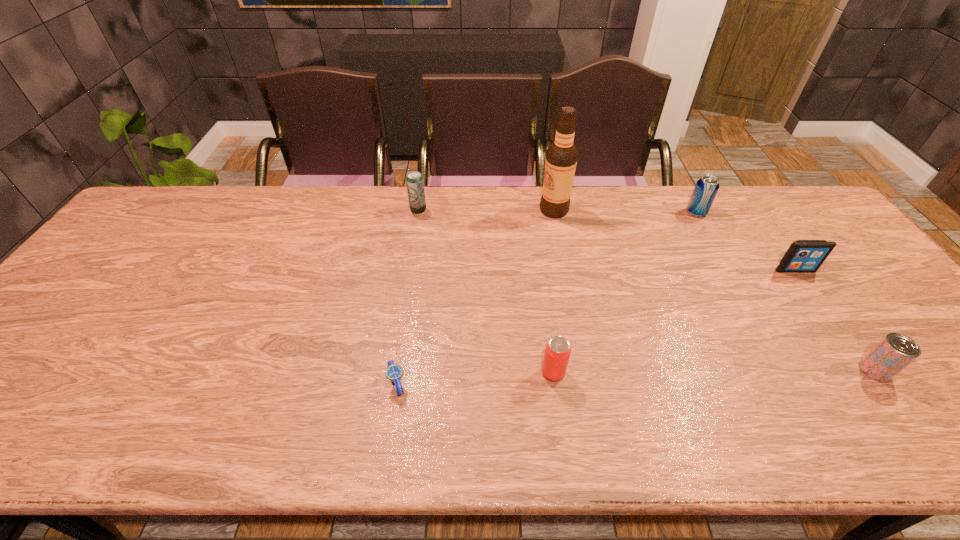
At what (x,y) coordinates should I click in order to perform the action: click on blank area located on the left of the leftmost beer can. Please return your answer as a coordinate pair (x, y). Image resolution: width=960 pixels, height=540 pixels. Looking at the image, I should click on (379, 210).

In order to click on vacant space positioned on the right of the third beer can from left to right in this screenshot , I will do `click(781, 212)`.

Where is `free space located 0.360m on the right of the second beer can from left to right`? free space located 0.360m on the right of the second beer can from left to right is located at coordinates (723, 373).

Locate an element on the screen. This screenshot has width=960, height=540. free space located on the front screen of the fourth farthest object is located at coordinates (845, 341).

Where is `vacant area situated on the back of the rightmost beer can`? vacant area situated on the back of the rightmost beer can is located at coordinates (825, 300).

Locate an element on the screen. Image resolution: width=960 pixels, height=540 pixels. free space located on the left of the watch is located at coordinates (333, 383).

Find the location of a particular element. This screenshot has height=540, width=960. alcohol at the far edge is located at coordinates [x=561, y=156].

Locate an element on the screen. This screenshot has height=540, width=960. iPod situated at the right edge is located at coordinates (803, 256).

Locate an element on the screen. The image size is (960, 540). beer can that is at the right edge is located at coordinates (895, 351).

Where is `vacant space at the far edge of the desktop`? vacant space at the far edge of the desktop is located at coordinates (473, 197).